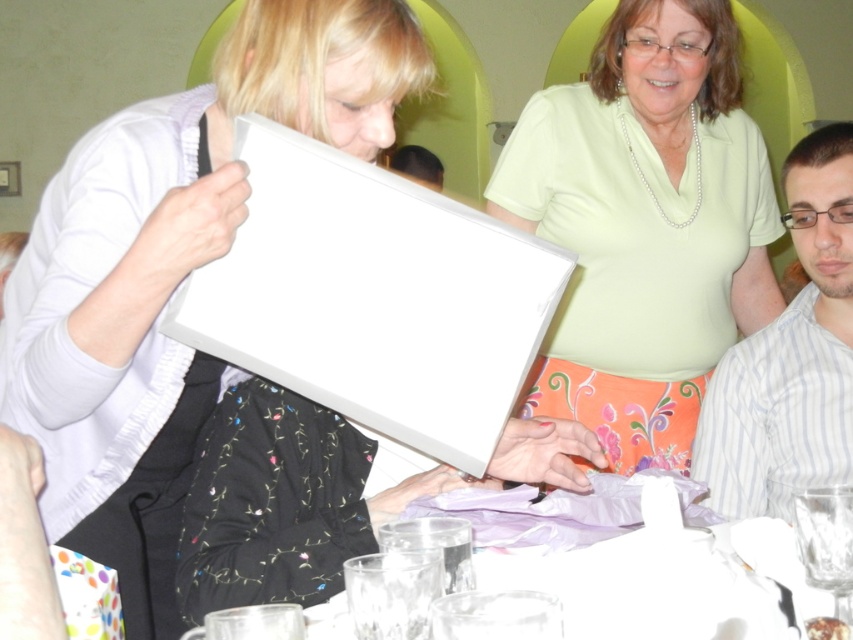
Does point (194, 260) lie in front of point (828, 243)?

Yes, point (194, 260) is closer to viewer.

Which is above, matte white frame at upper left or striped cotton shirt at right?

Positioned higher is striped cotton shirt at right.

The height and width of the screenshot is (640, 853). In order to click on matte white frame at upper left in this screenshot , I will do `click(171, 273)`.

Locate an element on the screen. This screenshot has width=853, height=640. matte white frame at upper left is located at coordinates (171, 273).

Is matte white frame at center shorter than striped cotton shirt at right?

No, matte white frame at center is not shorter than striped cotton shirt at right.

Between matte white frame at center and striped cotton shirt at right, which one has less height?

striped cotton shirt at right

What do you see at coordinates (645, 225) in the screenshot?
I see `matte white frame at center` at bounding box center [645, 225].

This screenshot has width=853, height=640. Identify the location of matte white frame at center. (645, 225).

Does matte white frame at center have a smaller size compared to translucent glass table at center?

Incorrect, matte white frame at center is not smaller in size than translucent glass table at center.

Measure the distance between point (x=598, y=141) and camera.

1.96 meters

Identify the location of matte white frame at center. (645, 225).